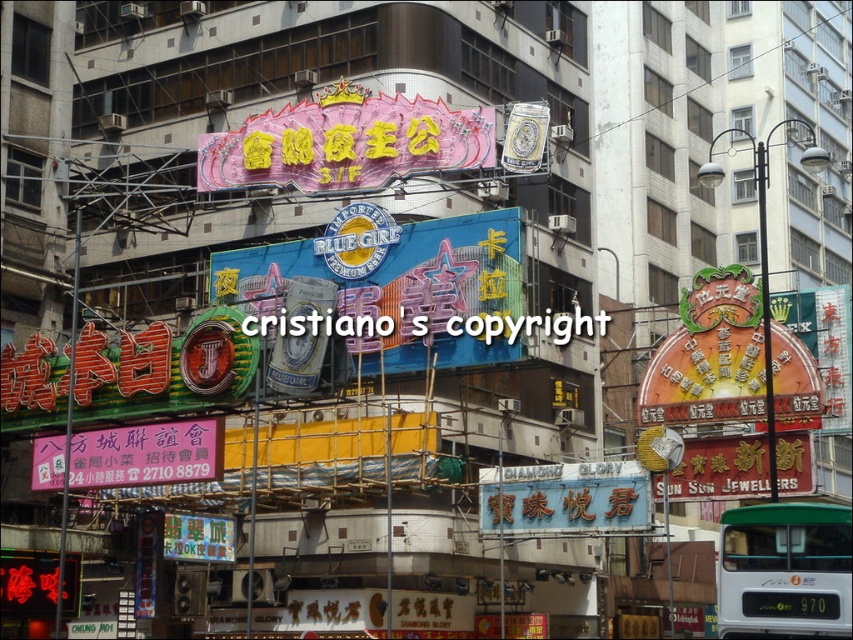
How distant is pink glossy neon sign at upper center from green matte bus at lower right?

pink glossy neon sign at upper center is 20.89 meters from green matte bus at lower right.

Which is behind, point (253, 116) or point (735, 593)?

Positioned behind is point (253, 116).

Locate an element on the screen. pink glossy neon sign at upper center is located at coordinates (346, 144).

Which is more to the left, green matte bus at lower right or black plastic text at center?

black plastic text at center

Identify the location of green matte bus at lower right. (784, 570).

Is point (405, 138) positioned behind point (363, 316)?

Yes, point (405, 138) is behind point (363, 316).

Find the location of a particular element. The image size is (853, 640). pink glossy neon sign at upper center is located at coordinates (346, 144).